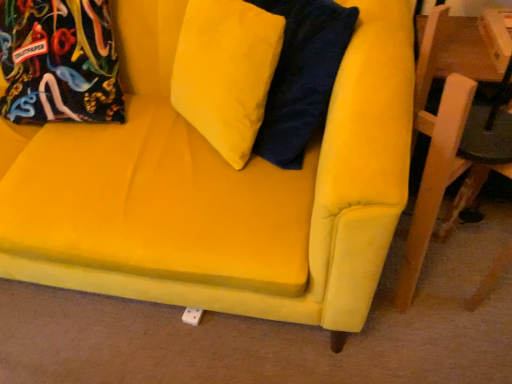
You are a GUI agent. You are given a task and a screenshot of the screen. Output one action in this format:
    pyautogui.click(x=<x>, y=<y>)
    Task: Click on the wooden chair at right
    This screenshot has width=512, height=384.
    Given the screenshot: What is the action you would take?
    pyautogui.click(x=444, y=132)

Measure the distance between point (x=462, y=109) and camera.

Point (x=462, y=109) is 27.99 inches away from camera.

Describe the element at coordinates (444, 132) in the screenshot. I see `wooden chair at right` at that location.

This screenshot has height=384, width=512. What are the coordinates of `wooden chair at right` in the screenshot? It's located at (444, 132).